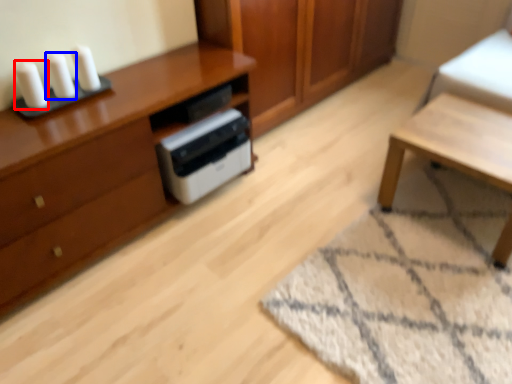
Question: Which object appears farthest to the camera in this image, candle (highlighted by a red box) or candle (highlighted by a blue box)?

Choices:
 (A) candle
 (B) candle

Answer: (B)